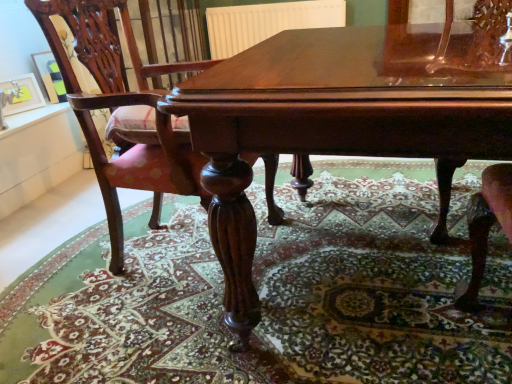
The width and height of the screenshot is (512, 384). In order to click on empty space that is ontop of white matte radiator at upper center (from a real-world perspective) in this screenshot , I will do `click(274, 2)`.